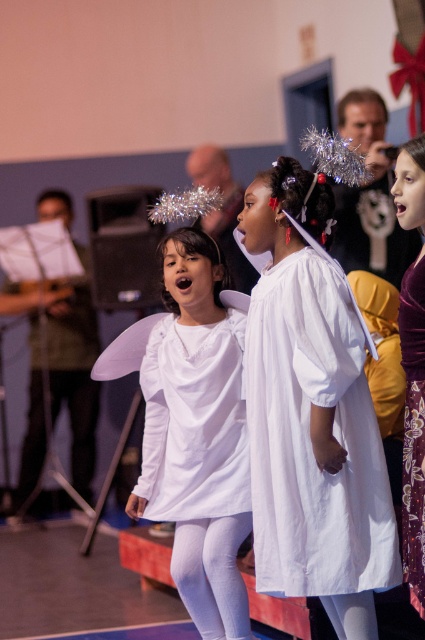
You are a photographer at the event and need to position a spotlight on the wider dress between the white matte dress at center and the velvet purple dress at right. Which dress should you choose?

The white matte dress at center is wider than the velvet purple dress at right, so you should position the spotlight on the white matte dress at center.

You are a photographer standing at the center of the stage. You want to take a photo of the white cotton dress at center. Where should you point your camera to capture it?

You should point your camera to the coordinates at point (309, 436) to capture the white cotton dress at center.